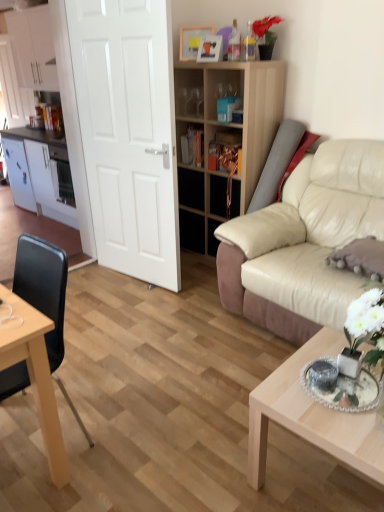
I want to click on free location to the left of light wood/texture coffee table at lower right, so click(212, 450).